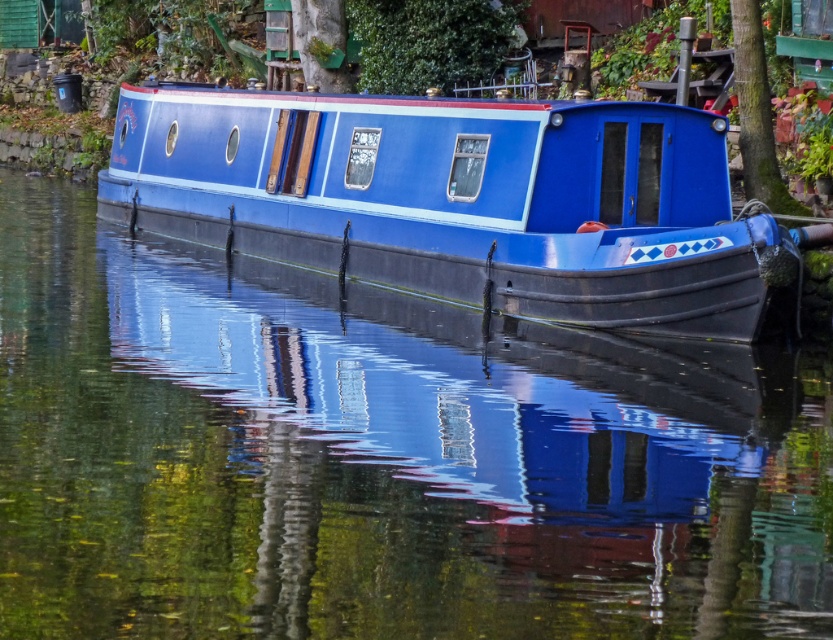
Question: Can you confirm if transparent glass water at center is smaller than blue glossy boat at center?

Choices:
 (A) no
 (B) yes

Answer: (B)

Question: Which of the following is the farthest from the observer?

Choices:
 (A) (151, 420)
 (B) (580, 195)
 (C) (739, 29)

Answer: (C)

Question: Which point is closer to the camera taking this photo?

Choices:
 (A) (357, 195)
 (B) (754, 84)
 (C) (469, 387)

Answer: (C)

Question: Does transparent glass water at center have a lesser width compared to blue glossy boat at center?

Choices:
 (A) no
 (B) yes

Answer: (A)

Question: Which of these objects is positioned farthest from the transparent glass water at center?

Choices:
 (A) blue glossy boat at center
 (B) green rough bark tree at upper right

Answer: (B)

Question: Is transparent glass water at center further to the viewer compared to blue glossy boat at center?

Choices:
 (A) yes
 (B) no

Answer: (B)